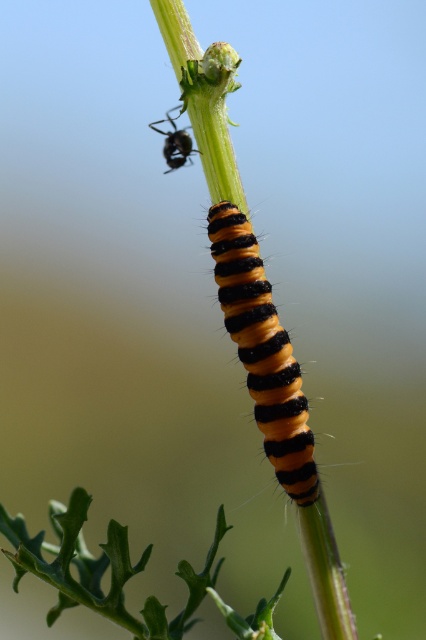
Question: Is orange fuzzy caterpillar at center below shiny black ant at upper center?

Choices:
 (A) yes
 (B) no

Answer: (A)

Question: Which point is farther to the camera?

Choices:
 (A) (180, 166)
 (B) (244, 356)

Answer: (A)

Question: Is orange fuzzy caterpillar at center to the right of shiny black ant at upper center from the viewer's perspective?

Choices:
 (A) no
 (B) yes

Answer: (B)

Question: Which of the following is the farthest from the observer?

Choices:
 (A) (276, 460)
 (B) (173, 122)

Answer: (B)

Question: Can you confirm if orange fuzzy caterpillar at center is wider than shiny black ant at upper center?

Choices:
 (A) no
 (B) yes

Answer: (B)